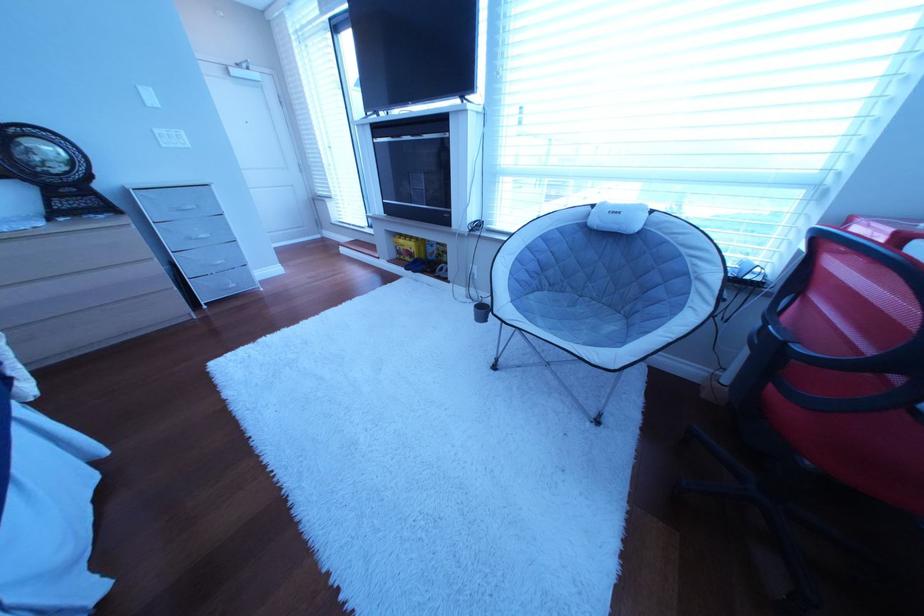
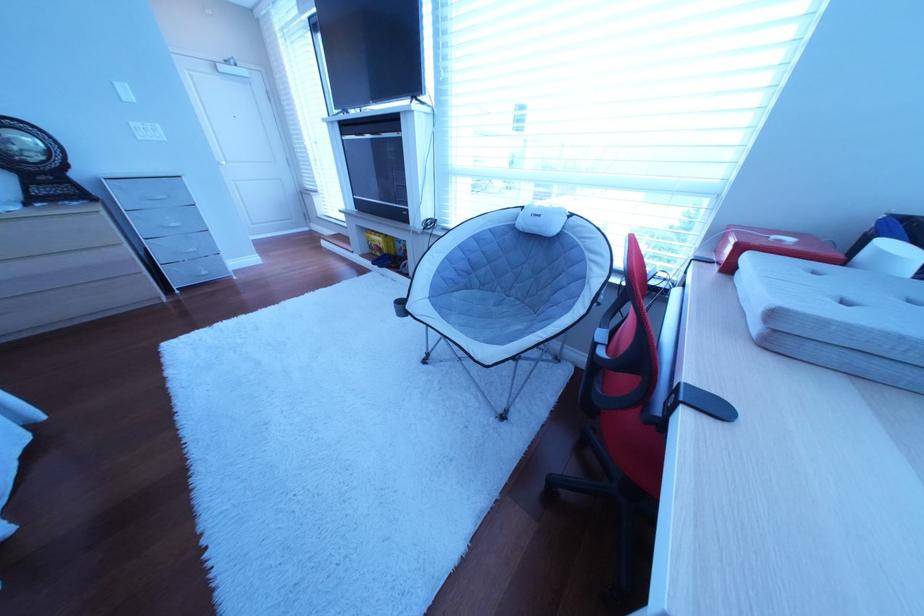
Find the pixel in the second image that matches pixel 235 264 in the first image.

(207, 252)